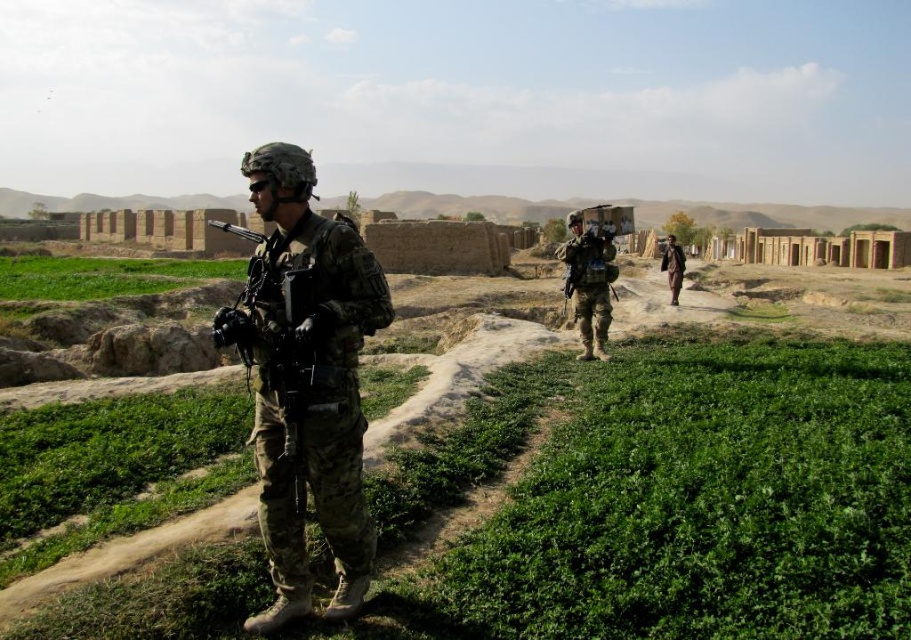
The image size is (911, 640). What do you see at coordinates (306, 380) in the screenshot?
I see `camouflage uniform at center` at bounding box center [306, 380].

Is camouflage uniform at center wider than matte black helmet at upper center?

Yes.

Locate an element on the screen. This screenshot has width=911, height=640. camouflage uniform at center is located at coordinates [306, 380].

This screenshot has height=640, width=911. Find the location of `camouflage uniform at center`. camouflage uniform at center is located at coordinates (306, 380).

Is matte black helmet at upper center taller than brown fabric jacket at center-right?

Indeed, matte black helmet at upper center has a greater height compared to brown fabric jacket at center-right.

Is matte black helmet at upper center closer to the viewer compared to brown fabric jacket at center-right?

Yes, it is in front of brown fabric jacket at center-right.

Describe the element at coordinates (589, 282) in the screenshot. I see `matte black helmet at upper center` at that location.

Where is `matte black helmet at upper center`? This screenshot has height=640, width=911. matte black helmet at upper center is located at coordinates (589, 282).

Does camouflage uniform at center have a lesser width compared to brown fabric jacket at center-right?

No, camouflage uniform at center is not thinner than brown fabric jacket at center-right.

Who is more distant from viewer, (224, 320) or (681, 257)?

The point (681, 257) is behind.

Does point (269, 353) lie behind point (668, 266)?

No, (269, 353) is closer to viewer.

Find the location of a particular element. camouflage uniform at center is located at coordinates (306, 380).